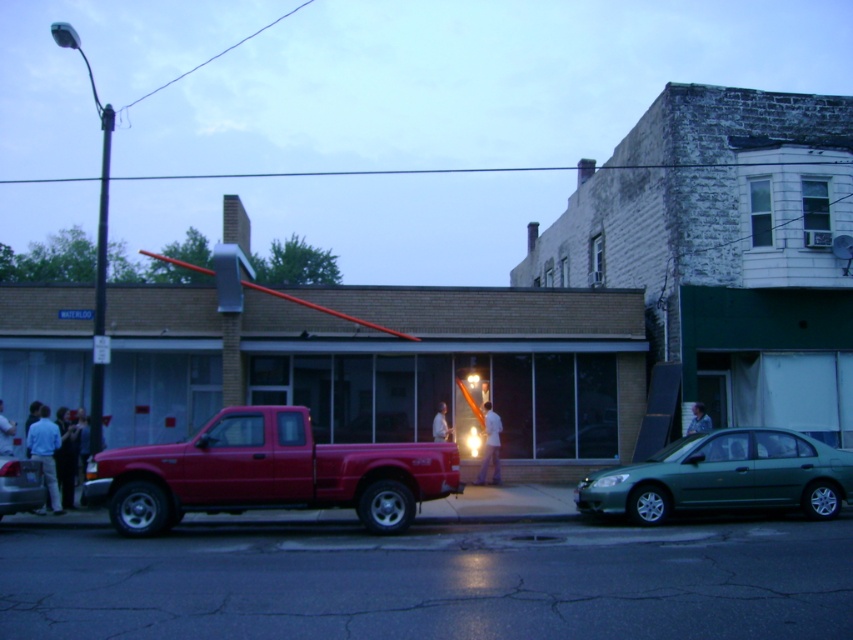
You are a delivery person trying to reach the camouflage shirt at center, which is your delivery destination. There is a green metallic sedan at lower right blocking your path. Can you walk around the sedan to reach your destination?

The green metallic sedan at lower right is positioned on the left side of camouflage shirt at center, so you can walk around the right side of the sedan to reach the camouflage shirt at center.

You are a pedestrian standing on the sidewalk and want to cross the street. There is a green metallic sedan at lower right and a light blue shirt at lower left in your view. Which object is closer to you as you prepare to step into the street?

The green metallic sedan at lower right is closer to you than the light blue shirt at lower left because it is in front of the light blue shirt at lower left.

You are a delivery person trying to park your metallic silver car at lower left at the designated spot at point (20, 484). Based on the scene description, is your current position already at the correct parking spot?

Yes, the metallic silver car at lower left is already located at point (20, 484), which matches the designated parking spot.